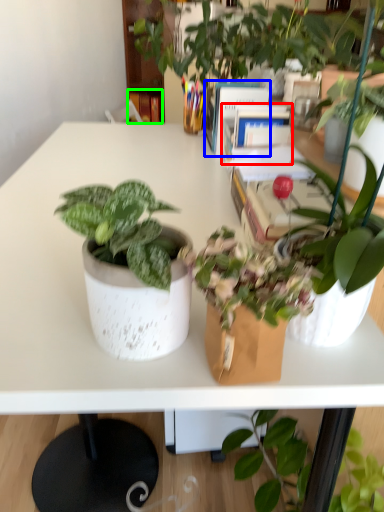
Question: Based on their relative distances, which object is nearer to book (highlighted by a red box)? Choose from book (highlighted by a blue box) and book (highlighted by a green box).

Choices:
 (A) book
 (B) book

Answer: (A)